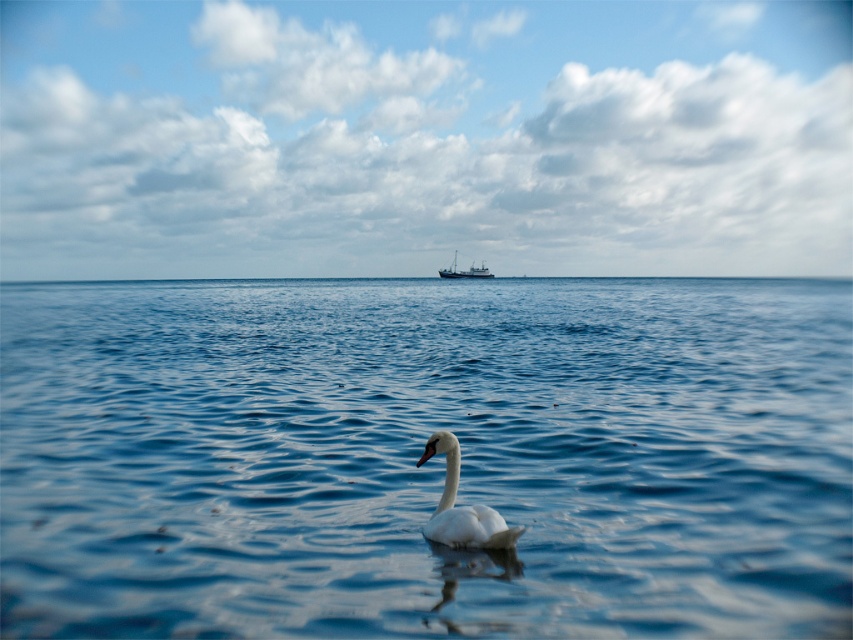
You are a photographer trying to capture the white glossy swan at center while ensuring the blue water at center is clearly visible in the background. Based on their positions, is the swan closer to you or farther away than the water?

The blue water at center is in front of the white glossy swan at center, meaning the water is closer to you than the swan. Therefore, the swan is farther away from you compared to the blue water at center.

You are standing on the shore looking at the seascape. There are two points marked on the image. The first point is at coordinates point (476, 516) and the second point is at point (491, 276). Which point is closer to you?

Point (476, 516) is closer to the viewer than point (491, 276).